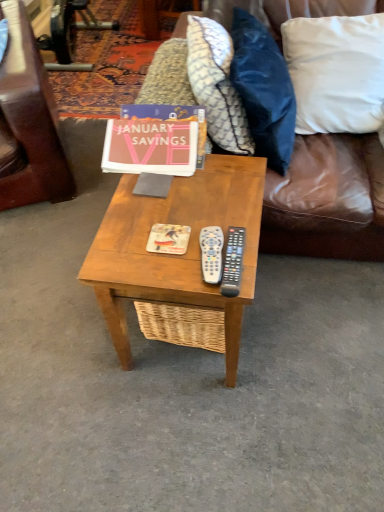
Where is `unoccupied space behind black plastic remote at right, marked as the first remote in a right-to-left arrangement`? This screenshot has height=512, width=384. unoccupied space behind black plastic remote at right, marked as the first remote in a right-to-left arrangement is located at coordinates (220, 209).